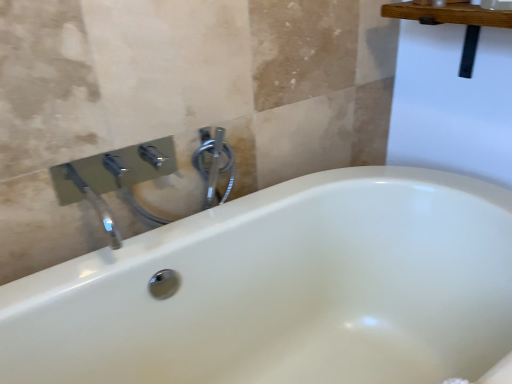
Question: From the image's perspective, is polished chrome faucet at upper center below polished chrome faucet at upper left?

Choices:
 (A) no
 (B) yes

Answer: (A)

Question: Could you tell me if polished chrome faucet at upper center is turned towards polished chrome faucet at upper left?

Choices:
 (A) yes
 (B) no

Answer: (A)

Question: Is polished chrome faucet at upper center taller than polished chrome faucet at upper left?

Choices:
 (A) yes
 (B) no

Answer: (B)

Question: Would you say polished chrome faucet at upper center contains polished chrome faucet at upper left?

Choices:
 (A) yes
 (B) no

Answer: (B)

Question: Is polished chrome faucet at upper center completely or partially outside of polished chrome faucet at upper left?

Choices:
 (A) yes
 (B) no

Answer: (B)

Question: Is polished chrome faucet at upper center shorter than polished chrome faucet at upper left?

Choices:
 (A) yes
 (B) no

Answer: (A)

Question: Is polished chrome faucet at upper left positioned with its back to polished chrome faucet at upper center?

Choices:
 (A) no
 (B) yes

Answer: (B)

Question: Is polished chrome faucet at upper left next to polished chrome faucet at upper center?

Choices:
 (A) no
 (B) yes

Answer: (A)

Question: Does polished chrome faucet at upper left have a smaller size compared to polished chrome faucet at upper center?

Choices:
 (A) yes
 (B) no

Answer: (B)

Question: Can you confirm if polished chrome faucet at upper left is wider than polished chrome faucet at upper center?

Choices:
 (A) yes
 (B) no

Answer: (A)

Question: Considering the relative sizes of polished chrome faucet at upper left and polished chrome faucet at upper center in the image provided, is polished chrome faucet at upper left shorter than polished chrome faucet at upper center?

Choices:
 (A) yes
 (B) no

Answer: (B)

Question: Considering the relative sizes of polished chrome faucet at upper left and polished chrome faucet at upper center in the image provided, is polished chrome faucet at upper left thinner than polished chrome faucet at upper center?

Choices:
 (A) yes
 (B) no

Answer: (B)

Question: Considering their positions, is polished chrome faucet at upper left located in front of or behind polished chrome faucet at upper center?

Choices:
 (A) behind
 (B) front

Answer: (B)